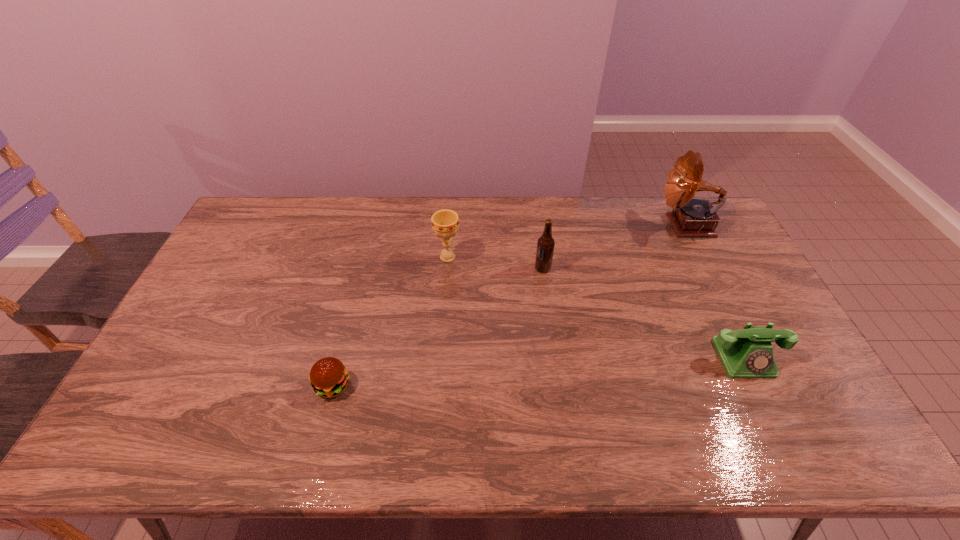
You are a GUI agent. You are given a task and a screenshot of the screen. Output one action in this format:
    pyautogui.click(x=<x>, y=<y>)
    Task: Click on the free point between the leftmost object and the phonograph_record
    Image resolution: width=960 pixels, height=540 pixels.
    Given the screenshot: What is the action you would take?
    pyautogui.click(x=510, y=306)

Where is `vacant space that is in between the telephone and the third tallest object`? vacant space that is in between the telephone and the third tallest object is located at coordinates (596, 307).

I want to click on free spot between the tallest object and the telephone, so click(715, 292).

Identify the location of vacant space that is in between the beer bottle and the shortest object. click(x=438, y=327).

The height and width of the screenshot is (540, 960). In order to click on empty location between the leftmost object and the third object from left to right in this screenshot , I will do `click(438, 327)`.

Locate an element on the screen. The width and height of the screenshot is (960, 540). free space between the third tallest object and the shortest object is located at coordinates (390, 321).

The image size is (960, 540). In order to click on object that is the second closest to the farthest object in this screenshot , I will do `click(545, 246)`.

Identify which object is the nearest to the beer bottle. Please provide its 2D coordinates. Your answer should be formatted as a tuple, i.e. [(x, y)], where the tuple contains the x and y coordinates of a point satisfying the conditions above.

[(445, 223)]

Where is `free spot that satisfies the following two spatial constraints: 1. on the horn of the phonograph_record; 2. on the dial of the telephone`? free spot that satisfies the following two spatial constraints: 1. on the horn of the phonograph_record; 2. on the dial of the telephone is located at coordinates (754, 358).